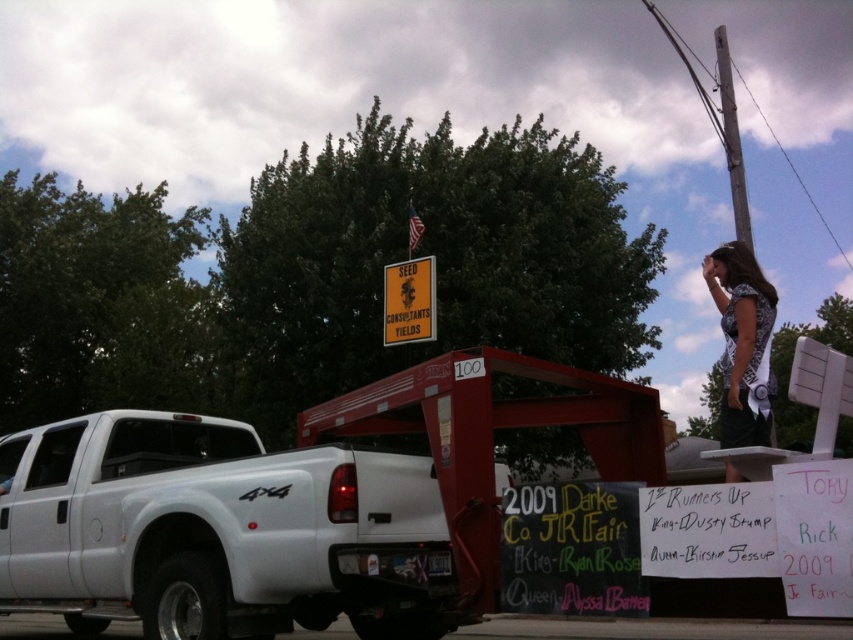
Is white matte truck at lower left below printed fabric blouse at right?

Correct, white matte truck at lower left is located below printed fabric blouse at right.

Who is higher up, white matte truck at lower left or printed fabric blouse at right?

Positioned higher is printed fabric blouse at right.

Find the location of a particular element. The image size is (853, 640). white matte truck at lower left is located at coordinates tap(218, 531).

Identify the location of white matte truck at lower left. This screenshot has height=640, width=853. (218, 531).

Which is above, white matte truck at lower left or gray wooden pole at upper right?

gray wooden pole at upper right is higher up.

Is point (337, 545) closer to camera compared to point (750, 232)?

Yes, it is in front of point (750, 232).

You are a GUI agent. You are given a task and a screenshot of the screen. Output one action in this format:
    pyautogui.click(x=<x>, y=<y>)
    Task: Click on the white matte truck at lower left
    This screenshot has height=640, width=853.
    Given the screenshot: What is the action you would take?
    pyautogui.click(x=218, y=531)

Does printed fabric blouse at right have a smaller size compared to yellow paper sign at center?

No.

Is printed fabric blouse at right behind yellow paper sign at center?

That is False.

Is point (741, 248) positioned in front of point (434, 314)?

Yes, point (741, 248) is in front of point (434, 314).

Locate an element on the screen. The width and height of the screenshot is (853, 640). printed fabric blouse at right is located at coordinates (741, 342).